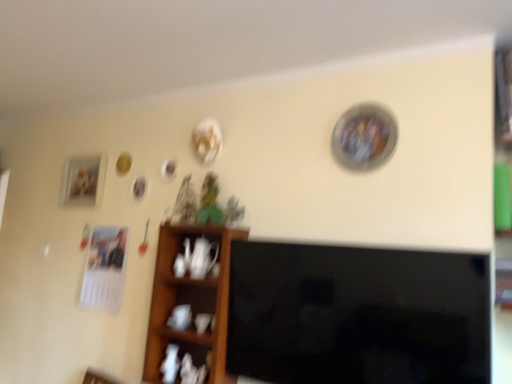
Question: From the image's perspective, is black glossy tv at center located above or below matte wooden picture frame at left?

Choices:
 (A) below
 (B) above

Answer: (A)

Question: Considering the positions of black glossy tv at center and matte wooden picture frame at left in the image, is black glossy tv at center bigger or smaller than matte wooden picture frame at left?

Choices:
 (A) small
 (B) big

Answer: (B)

Question: Which is nearer to the black glossy tv at center?

Choices:
 (A) wooden shelf at center
 (B) matte wooden picture frame at left

Answer: (A)

Question: Which is farther from the black glossy tv at center?

Choices:
 (A) wooden shelf at center
 (B) matte wooden picture frame at left

Answer: (B)